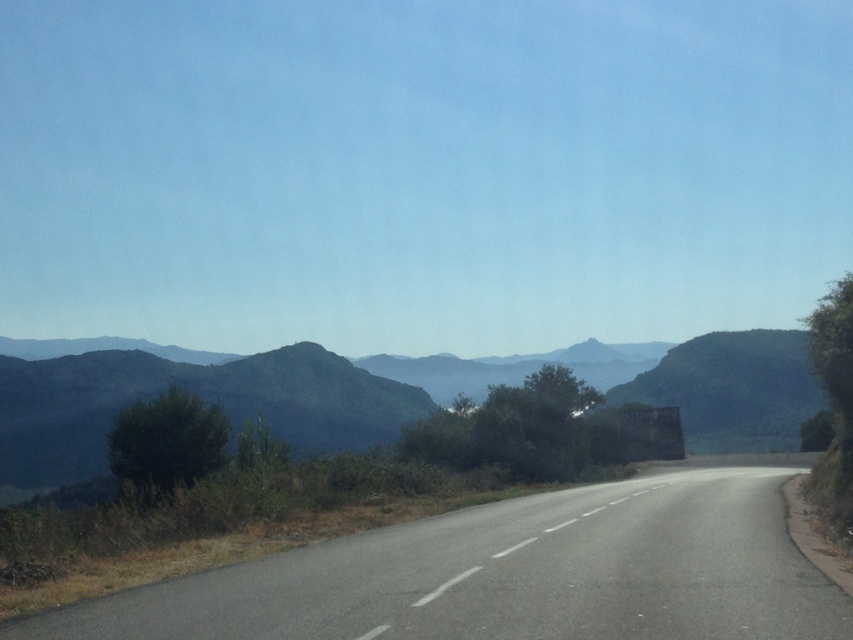
Based on the photo, you are driving a car and want to reach the green textured mountain at center. According to the scene, which direction should you head towards since the asphalt road at center leads towards it?

The asphalt road at center is positioned over the green textured mountain at center, so you should follow the asphalt road at center towards the mountain to reach it.

You are driving a car and see the asphalt road at center and the green textured mountain at center. Which object is located to the right side from your perspective?

The asphalt road at center is to the right of green textured mountain at center, so the asphalt road at center is located to the right side from your perspective.